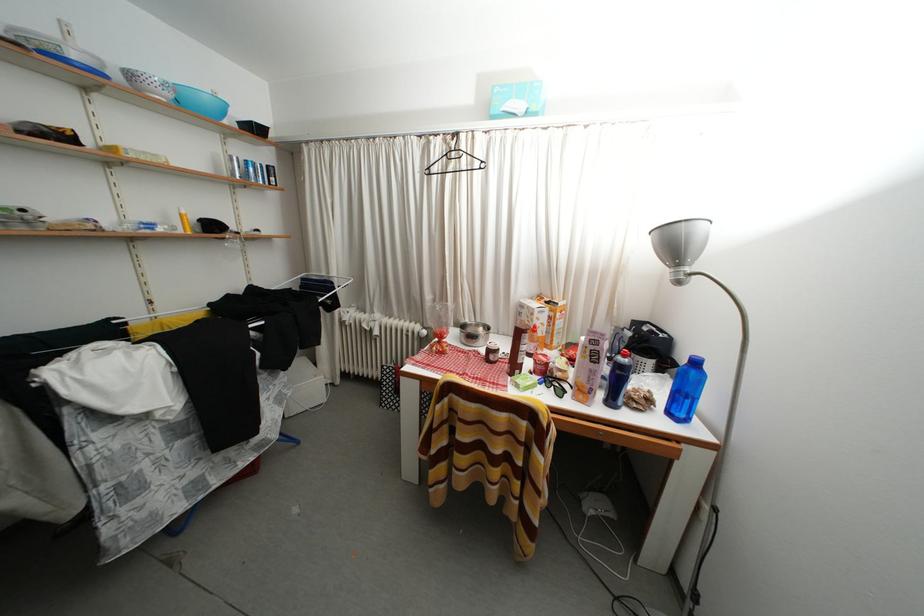
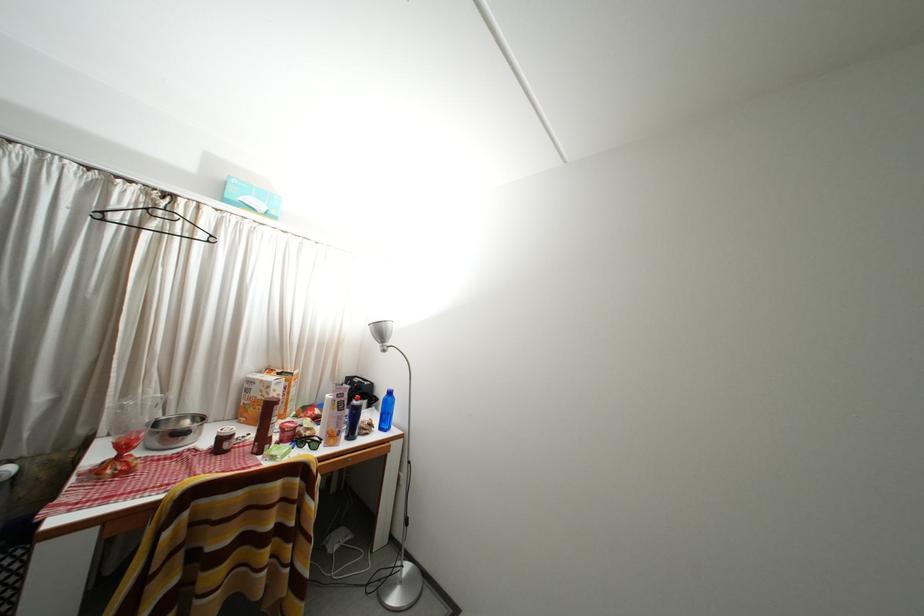
Question: The camera is either moving clockwise (left) or counter-clockwise (right) around the object. The first image is from the beginning of the video and the second image is from the end. Is the camera moving left or right when shooting the video?

Choices:
 (A) Left
 (B) Right

Answer: (A)